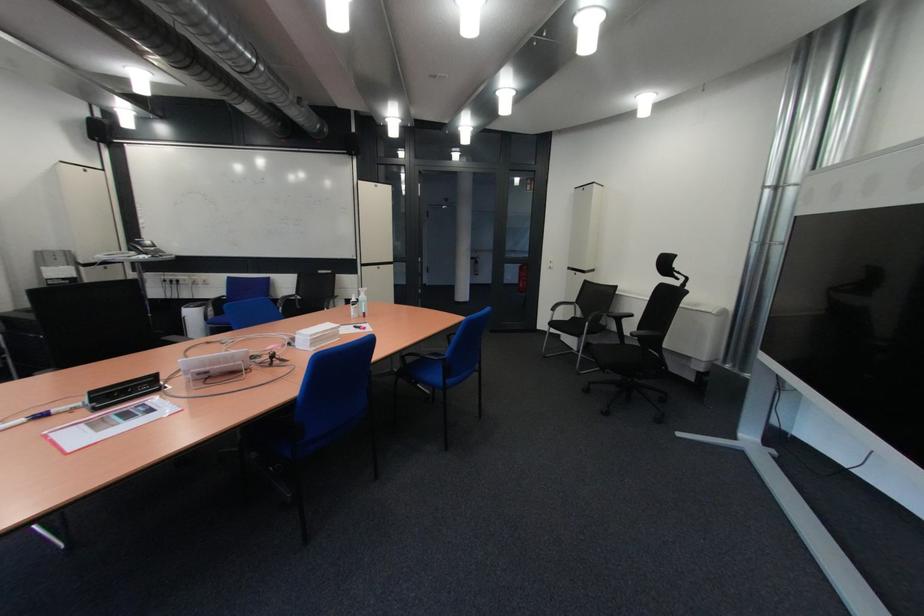
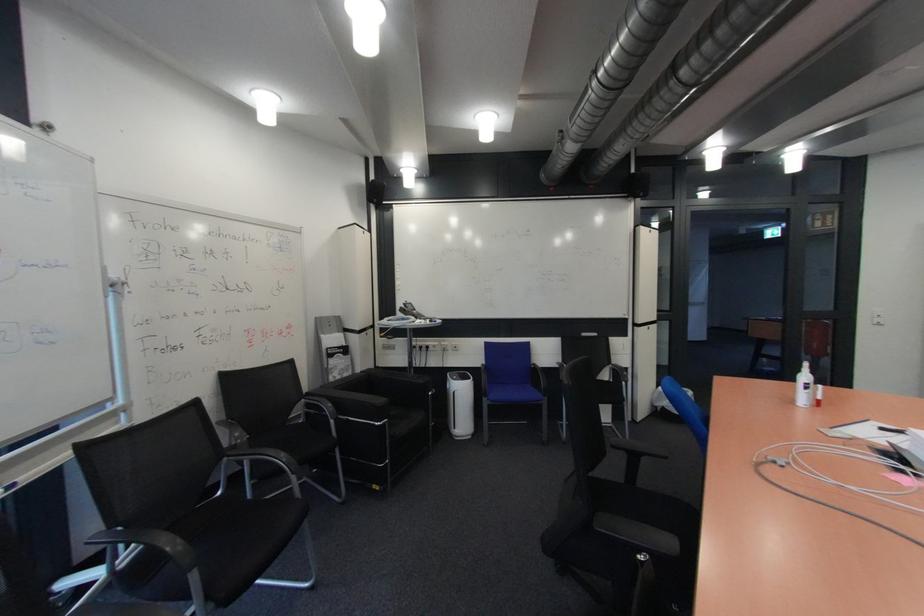
Question: The images are taken continuously from a first-person perspective. In which direction are you moving?

Choices:
 (A) Left
 (B) Right
 (C) Forward
 (D) Backward

Answer: (A)